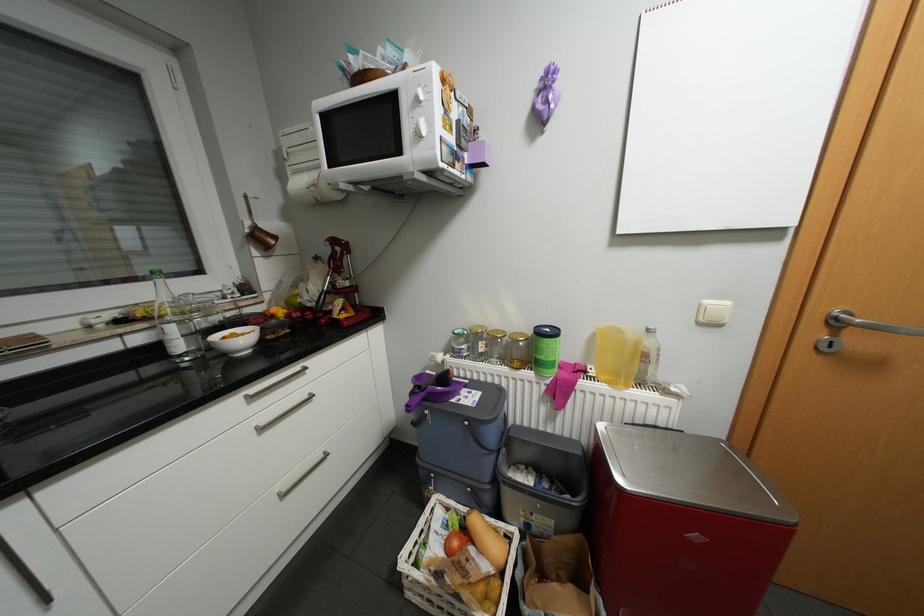
This screenshot has width=924, height=616. In order to click on steel trash can lid in this screenshot , I will do `click(696, 474)`.